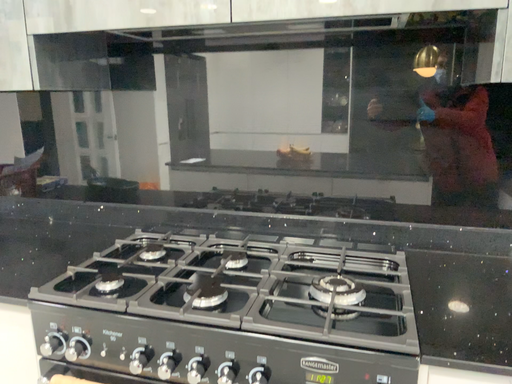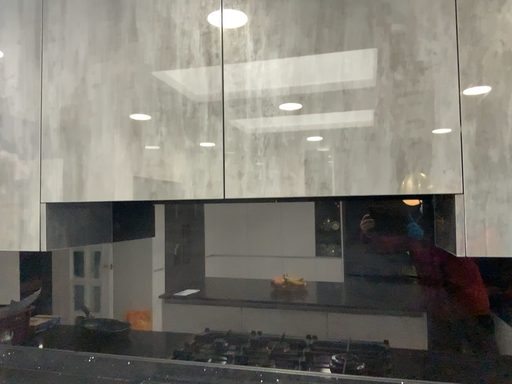
Question: How did the camera likely rotate when shooting the video?

Choices:
 (A) rotated upward
 (B) rotated downward

Answer: (A)